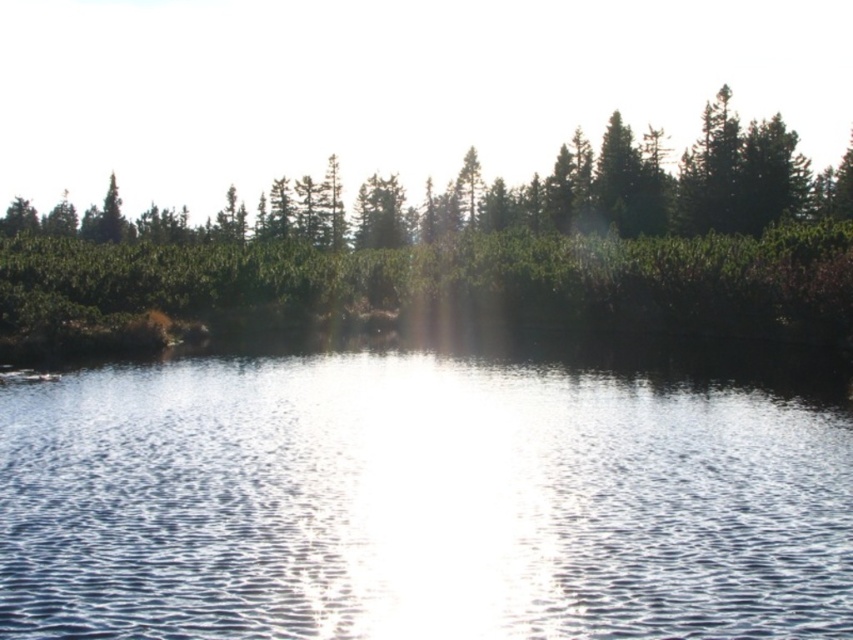
Question: Which of the following is the farthest from the observer?

Choices:
 (A) (679, 600)
 (B) (717, 289)

Answer: (B)

Question: Considering the relative positions of clear water at center and green textured foliage at upper center in the image provided, where is clear water at center located with respect to green textured foliage at upper center?

Choices:
 (A) above
 (B) below

Answer: (B)

Question: Does clear water at center have a larger size compared to green textured foliage at upper center?

Choices:
 (A) no
 (B) yes

Answer: (A)

Question: Is clear water at center closer to the viewer compared to green textured foliage at upper center?

Choices:
 (A) no
 (B) yes

Answer: (B)